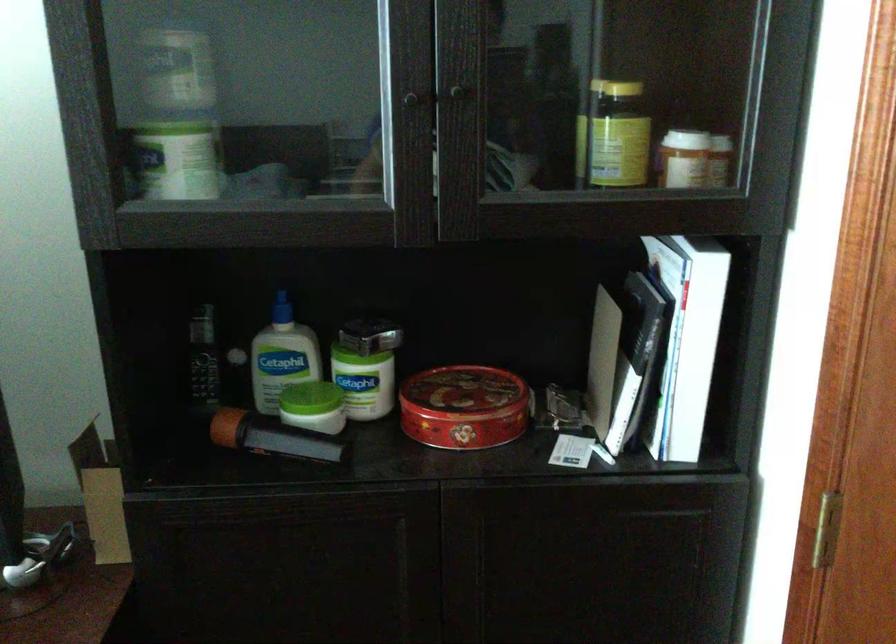
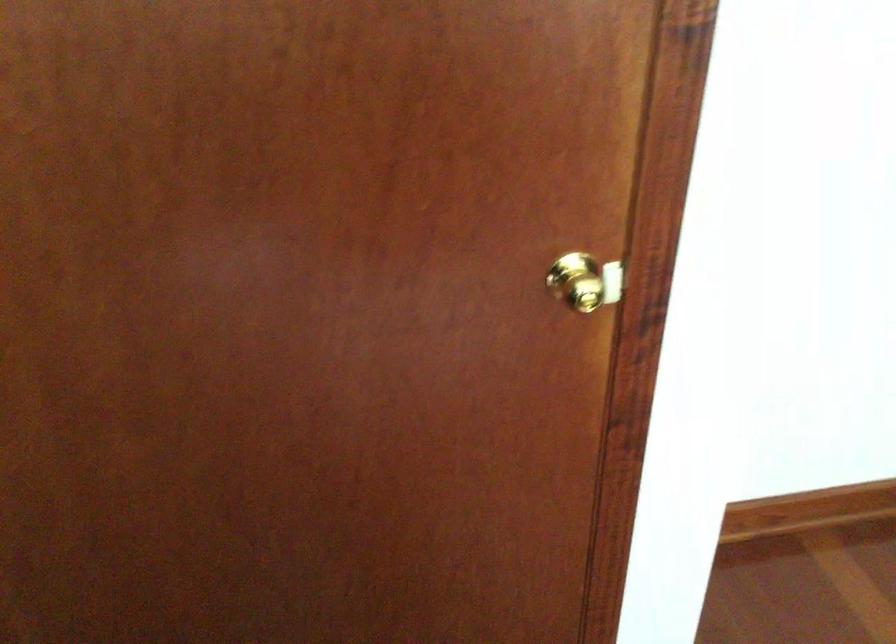
The images are taken continuously from a first-person perspective. In which direction is your viewpoint rotating?

The camera rotated toward right-down.